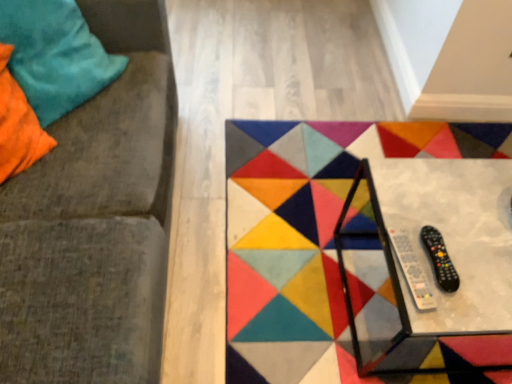
Identify the location of vacant area on the back side of black plastic remote control at lower right. This screenshot has width=512, height=384. (424, 203).